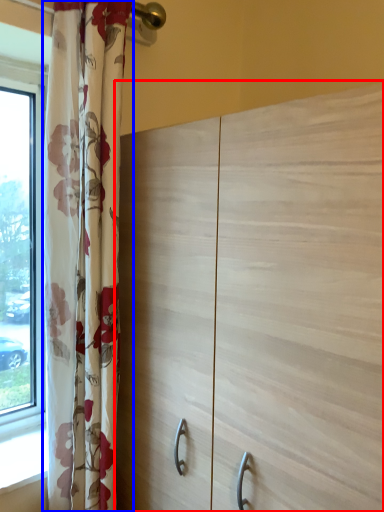
Question: Among these objects, which one is farthest to the camera, cupboard (highlighted by a red box) or curtain (highlighted by a blue box)?

Choices:
 (A) cupboard
 (B) curtain

Answer: (B)